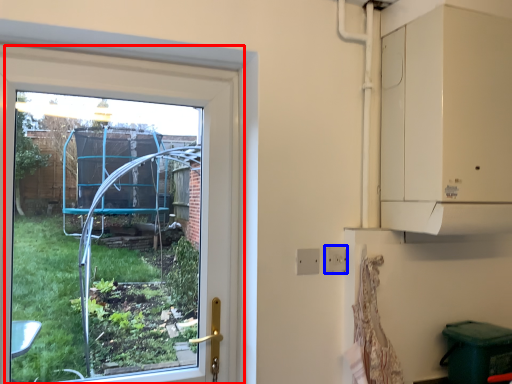
Question: Which object is further to the camera taking this photo, window (highlighted by a red box) or electric outlet (highlighted by a blue box)?

Choices:
 (A) window
 (B) electric outlet

Answer: (B)